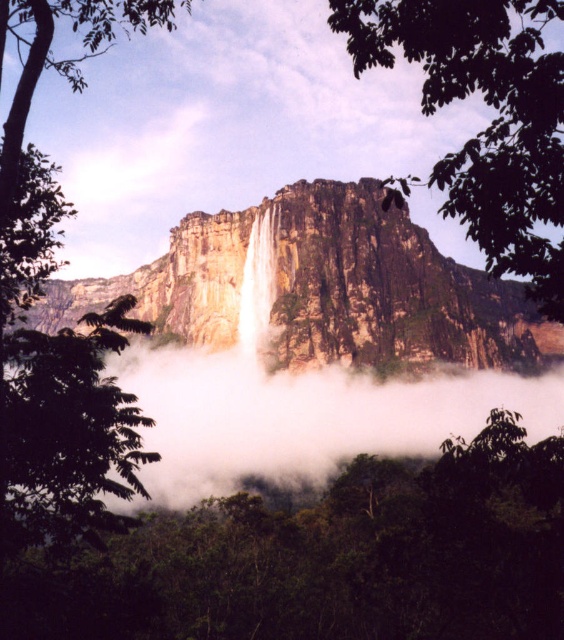
In the scene shown: You are standing at the point where the camera is located, and you want to reach the point at coordinates point (63,307). If you can walk at a speed of 1.5 meters per second, how long will it take you to reach that point?

The distance between point (63,307) and the camera is 200.45 meters. At a walking speed of 1.5 meters per second, it would take approximately 133.6 seconds, which is about 2 minutes and 14 seconds, to reach the point.

You are a hiker standing at the base of the waterfall. You want to climb up to the top of the rocky cliff at center. Which direction should you move relative to the white smooth waterfall at center to reach the cliff?

You should move to the right of the white smooth waterfall at center to reach the rocky cliff at center, since the rocky cliff at center is located to the right of the waterfall.